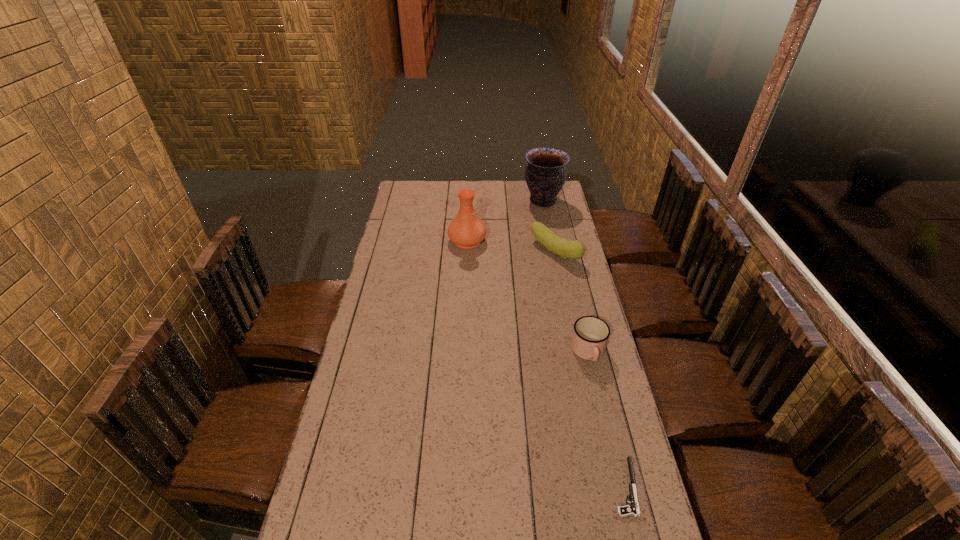
You are a GUI agent. You are given a task and a screenshot of the screen. Output one action in this format:
    pyautogui.click(x=<x>, y=<y>)
    Task: Click on the free space located 0.290m on the back of the cucumber
    
    Given the screenshot: What is the action you would take?
    [x=545, y=204]

Locate an element on the screen. The width and height of the screenshot is (960, 540). free space located on the side of the second nearest object with the handle is located at coordinates (599, 395).

The width and height of the screenshot is (960, 540). Find the location of `vacant space situated 0.110m on the front-facing side of the shortest object`. vacant space situated 0.110m on the front-facing side of the shortest object is located at coordinates (572, 487).

Locate an element on the screen. vacant space located on the front-facing side of the shortest object is located at coordinates (590, 487).

Image resolution: width=960 pixels, height=540 pixels. I want to click on vacant space situated on the front-facing side of the shortest object, so click(x=479, y=487).

Where is `object situated at the far edge`? Image resolution: width=960 pixels, height=540 pixels. object situated at the far edge is located at coordinates (545, 174).

You are a GUI agent. You are given a task and a screenshot of the screen. Output one action in this format:
    pyautogui.click(x=<x>, y=<y>)
    Task: Click on the pottery present at the right edge
    This screenshot has height=540, width=960.
    Given the screenshot: What is the action you would take?
    pyautogui.click(x=545, y=174)

The image size is (960, 540). Find the location of `cucumber that is at the right edge`. cucumber that is at the right edge is located at coordinates (565, 248).

Find the location of a particular element. The height and width of the screenshot is (540, 960). mug located in the right edge section of the desktop is located at coordinates (590, 335).

Find the location of a particular element. pistol that is positioned at the right edge is located at coordinates (633, 509).